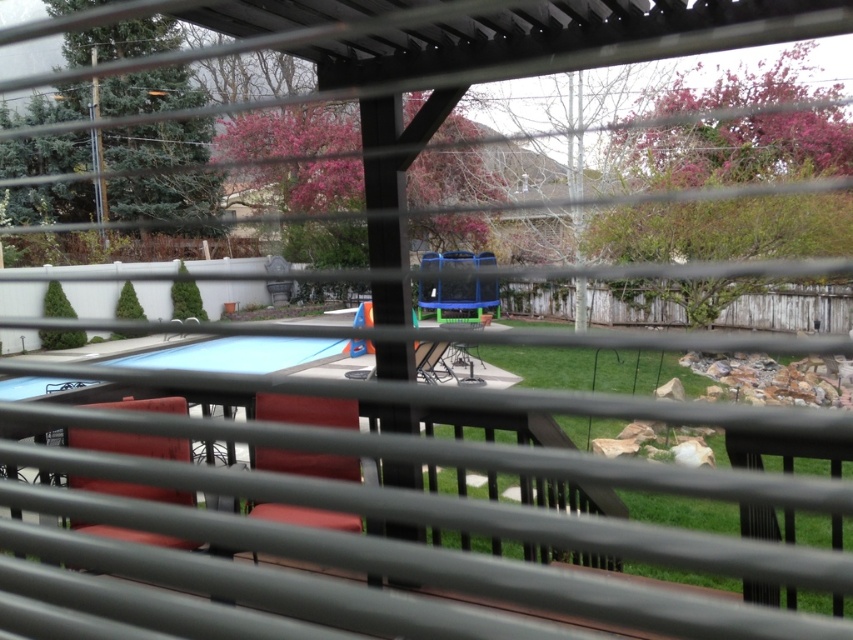
Is velvet red chair at center further to camera compared to metallic silver table at center?

No, it is not.

Is point (260, 401) in front of point (440, 349)?

Yes.

Where is `velvet red chair at center`? The width and height of the screenshot is (853, 640). velvet red chair at center is located at coordinates (306, 410).

Describe the element at coordinates (129, 444) in the screenshot. The image size is (853, 640). I see `velvet red chair at left` at that location.

Does point (186, 440) come farther from viewer compared to point (436, 380)?

No, (186, 440) is closer to viewer.

I want to click on velvet red chair at left, so click(129, 444).

Is velvet red chair at center shorter than velvet red chair at left?

No, velvet red chair at center is not shorter than velvet red chair at left.

Is velvet red chair at center closer to camera compared to velvet red chair at left?

No, velvet red chair at center is behind velvet red chair at left.

You are a GUI agent. You are given a task and a screenshot of the screen. Output one action in this format:
    pyautogui.click(x=<x>, y=<y>)
    Task: Click on the velvet red chair at center
    The width and height of the screenshot is (853, 640).
    Given the screenshot: What is the action you would take?
    pyautogui.click(x=306, y=410)

You are a GUI agent. You are given a task and a screenshot of the screen. Output one action in this format:
    pyautogui.click(x=<x>, y=<y>)
    Task: Click on the velvet red chair at center
    The height and width of the screenshot is (640, 853).
    Given the screenshot: What is the action you would take?
    pyautogui.click(x=306, y=410)